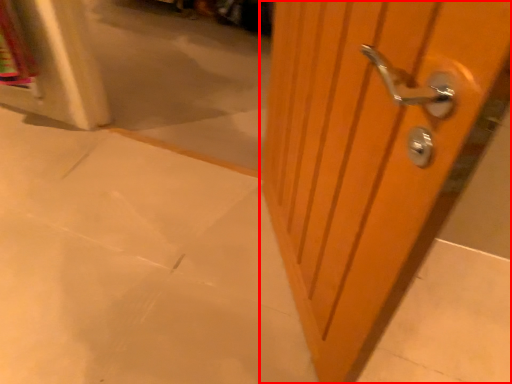
Question: From the image, what is the correct spatial relationship of door (annotated by the red box) in relation to concrete?

Choices:
 (A) right
 (B) left

Answer: (A)